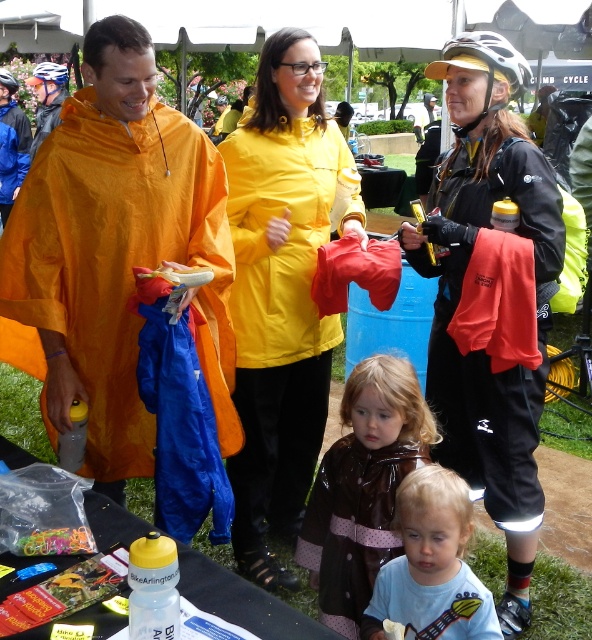
You are a photographer trying to capture a photo of the orange waterproof poncho at left and the brown shiny raincoat at center. Which object should you focus on first if you want to include both in your frame without moving the camera?

The orange waterproof poncho at left is to the left of brown shiny raincoat at center, so you should focus on the orange waterproof poncho at left first to ensure both are in frame without moving the camera.

What is the object located at the coordinates point (118, 252) in the image?

The orange waterproof poncho at left is located at point (118, 252).

You are organizing a group photo and need to arrange the orange waterproof poncho at left and the black matte jacket at right in a row. If you want to place them side by side without overlapping, which one should be placed first to accommodate their widths?

The orange waterproof poncho at left is wider than the black matte jacket at right, so it should be placed first to accommodate its width.